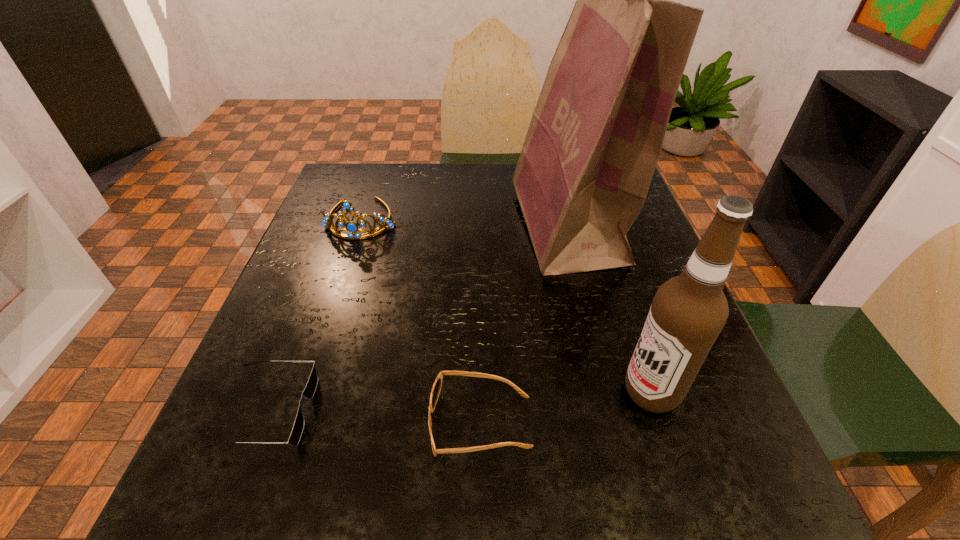
Where is `empty location between the third object from right to left and the third shortest object`? Image resolution: width=960 pixels, height=540 pixels. empty location between the third object from right to left and the third shortest object is located at coordinates (421, 321).

The width and height of the screenshot is (960, 540). In order to click on vacant point located between the left sunglasses and the tallest object in this screenshot , I will do `click(419, 319)`.

The height and width of the screenshot is (540, 960). Find the location of `free spot between the third shortest object and the grocery bag`. free spot between the third shortest object and the grocery bag is located at coordinates (465, 223).

Select which object is the third closest to the grocery bag. Please provide its 2D coordinates. Your answer should be formatted as a tuple, i.e. [(x, y)], where the tuple contains the x and y coordinates of a point satisfying the conditions above.

[(351, 227)]

Identify which object is the third closest to the taller sunglasses. Please provide its 2D coordinates. Your answer should be formatted as a tuple, i.e. [(x, y)], where the tuple contains the x and y coordinates of a point satisfying the conditions above.

[(593, 143)]

Identify the location of free point that satisfies the following two spatial constraints: 1. on the front-facing side of the third tallest object; 2. on the front-facing side of the left sunglasses. (298, 411).